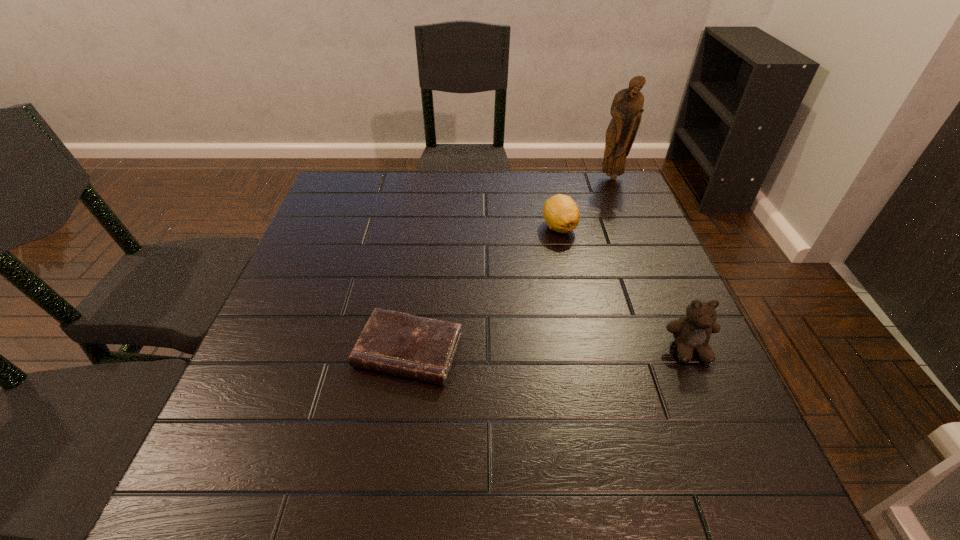
Locate an element on the screen. Image resolution: width=960 pixels, height=540 pixels. vacant space located 0.270m at the stem end of the third nearest object is located at coordinates (557, 318).

Where is `vacant space located at the stem end of the third nearest object`? The image size is (960, 540). vacant space located at the stem end of the third nearest object is located at coordinates (557, 335).

At what (x,y) coordinates should I click in order to perform the action: click on blank space located on the front-facing side of the figurine. Please return your answer as a coordinate pair (x, y). The width and height of the screenshot is (960, 540). Looking at the image, I should click on (594, 226).

I want to click on vacant space located on the front-facing side of the figurine, so click(597, 218).

At what (x,y) coordinates should I click in order to perform the action: click on free spot located on the front-facing side of the figurine. Please return your answer as a coordinate pair (x, y). The width and height of the screenshot is (960, 540). Looking at the image, I should click on (605, 196).

This screenshot has width=960, height=540. Identify the location of lemon situated at the far edge. point(561,213).

Find the location of a particular element. figurine that is at the far edge is located at coordinates (626, 110).

This screenshot has width=960, height=540. In order to click on teddy bear present at the right edge in this screenshot , I will do point(692,332).

The height and width of the screenshot is (540, 960). What are the coordinates of `figurine that is at the right edge` in the screenshot? It's located at click(x=626, y=110).

Identify the location of object at the far right corner. This screenshot has width=960, height=540. (626, 110).